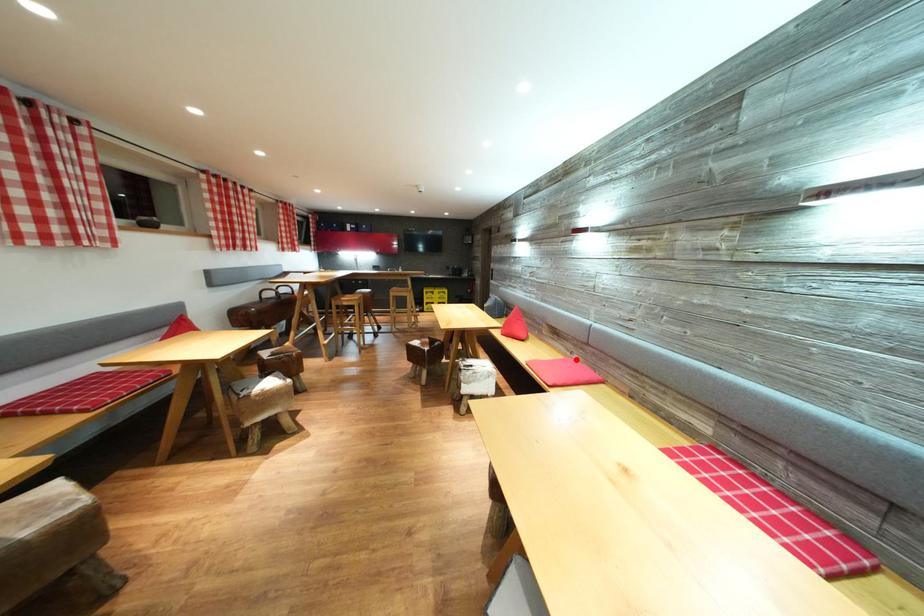
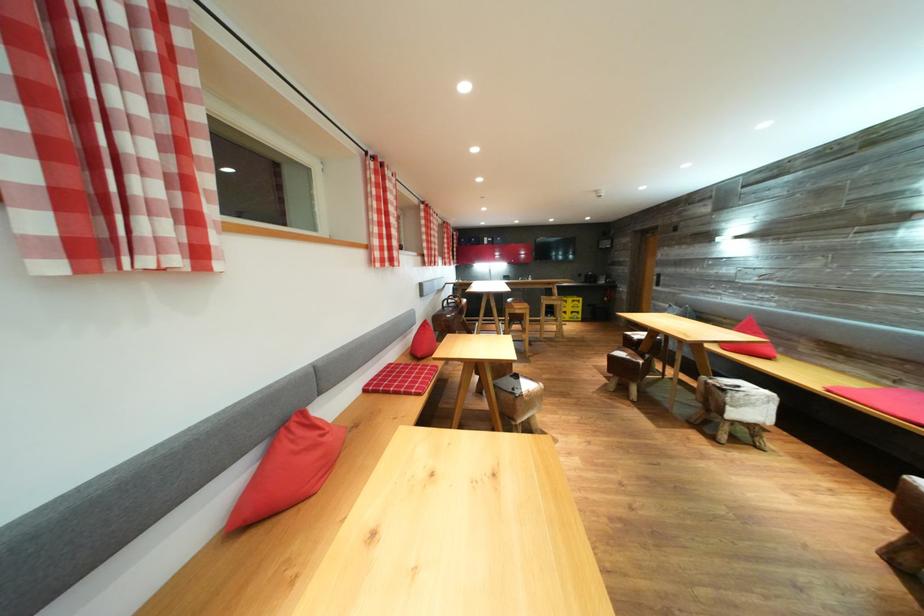
The point at the highlighted location is marked in the first image. Where is the corresponding point in the second image?

(895, 389)